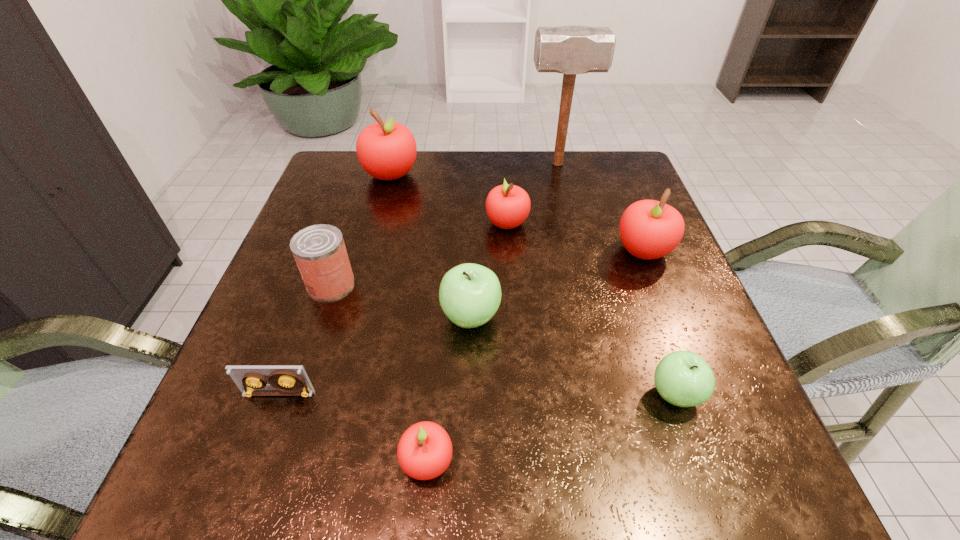
This screenshot has width=960, height=540. I want to click on the right green apple, so click(683, 378).

At what (x,y) coordinates should I click in order to perform the action: click on the nearest apple. Please return your answer as a coordinate pair (x, y). Image resolution: width=960 pixels, height=540 pixels. Looking at the image, I should click on (424, 452).

At what (x,y) coordinates should I click in order to perform the action: click on the nearest object. Please return your answer as a coordinate pair (x, y). Looking at the image, I should click on (424, 452).

Image resolution: width=960 pixels, height=540 pixels. I want to click on the shortest object, so click(290, 379).

Identify the location of brown videotape. The height and width of the screenshot is (540, 960). (290, 379).

The width and height of the screenshot is (960, 540). I want to click on free location located on the striking face of the tallest object, so click(508, 164).

Identify the location of vacant area situated on the striking face of the tallest object. The width and height of the screenshot is (960, 540). (505, 164).

I want to click on free region located on the striking face of the tallest object, so click(385, 164).

The width and height of the screenshot is (960, 540). In order to click on free space located 0.250m on the right of the tallest apple in this screenshot , I will do `click(513, 174)`.

You are a GUI agent. You are given a task and a screenshot of the screen. Output one action in this format:
    pyautogui.click(x=<x>, y=<y>)
    Task: Click on the vacant space situated on the back of the seventh shortest object
    
    Given the screenshot: What is the action you would take?
    pyautogui.click(x=606, y=156)